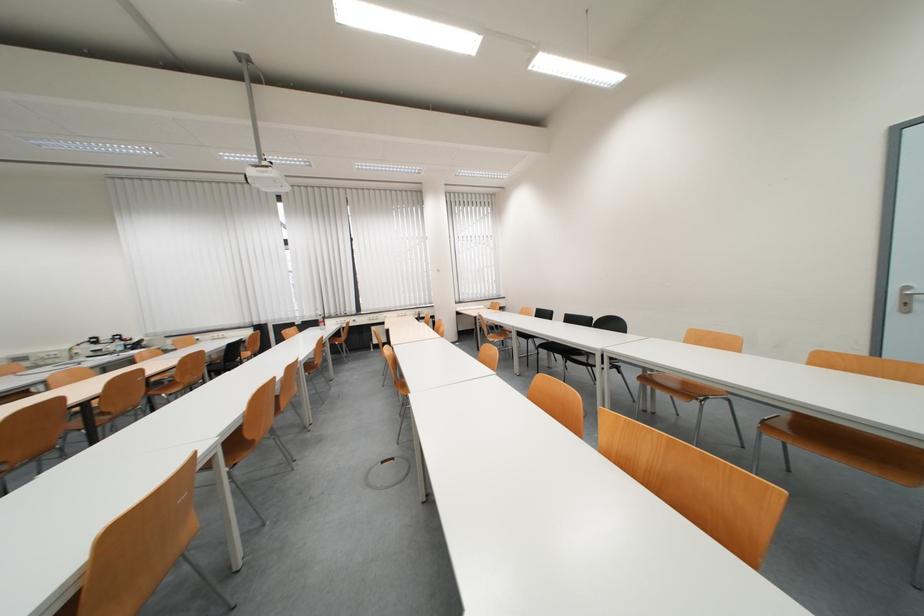
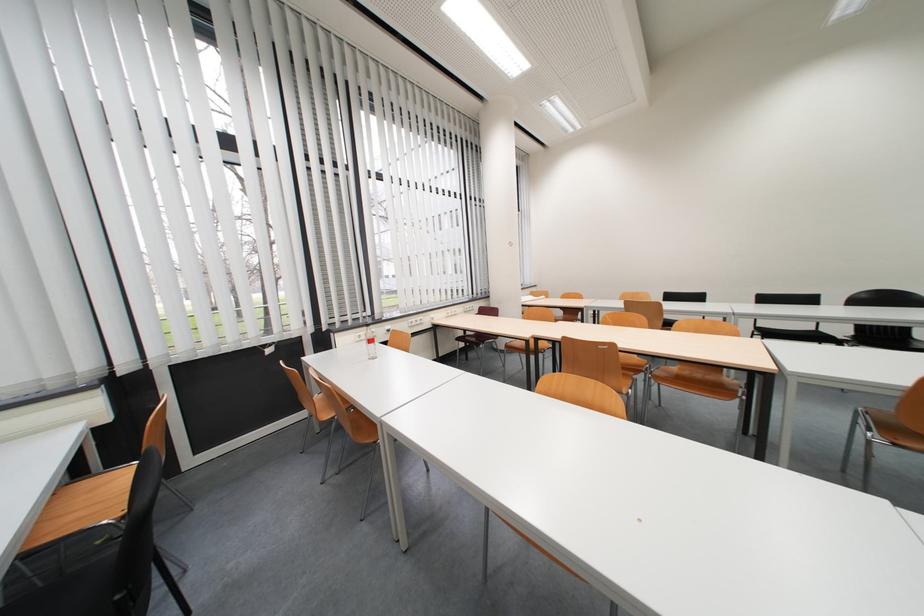
In a continuous first-person perspective shot, in which direction is the camera moving?

The movement direction of the cameraman is left, forward.